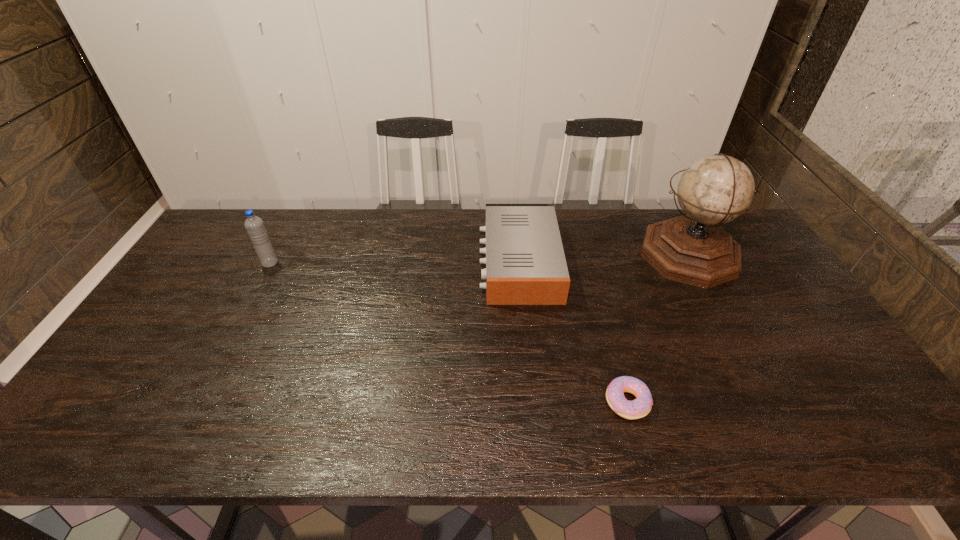
Image resolution: width=960 pixels, height=540 pixels. What are the coordinates of `vacant space positioned 0.270m on the surface of the rightmost object` in the screenshot? It's located at (x=557, y=255).

At what (x,y) coordinates should I click in order to perform the action: click on free space located on the right of the second tallest object. Please return your answer as a coordinate pair (x, y). This screenshot has width=960, height=540. Looking at the image, I should click on (298, 263).

Find the location of `vacant space located on the control panel of the second object from left to right`. vacant space located on the control panel of the second object from left to right is located at coordinates (383, 261).

Locate an element on the screen. The height and width of the screenshot is (540, 960). free point located 0.250m on the control panel of the second object from left to right is located at coordinates pyautogui.click(x=401, y=261).

Locate an element on the screen. The height and width of the screenshot is (540, 960). vacant point located on the control panel of the second object from left to right is located at coordinates (398, 261).

You are a GUI agent. You are given a task and a screenshot of the screen. Output one action in this format:
    pyautogui.click(x=<x>, y=<y>)
    Task: Click on the free point located on the back of the shortest object
    
    Given the screenshot: What is the action you would take?
    pyautogui.click(x=598, y=295)

Image resolution: width=960 pixels, height=540 pixels. Identify the location of globe that is at the far edge. (692, 249).

What are the coordinates of `radio receiver present at the far edge` in the screenshot? It's located at (525, 262).

Where is `object at the near edge`? object at the near edge is located at coordinates (638, 408).

Where is `object present at the right edge`? The width and height of the screenshot is (960, 540). object present at the right edge is located at coordinates (692, 249).